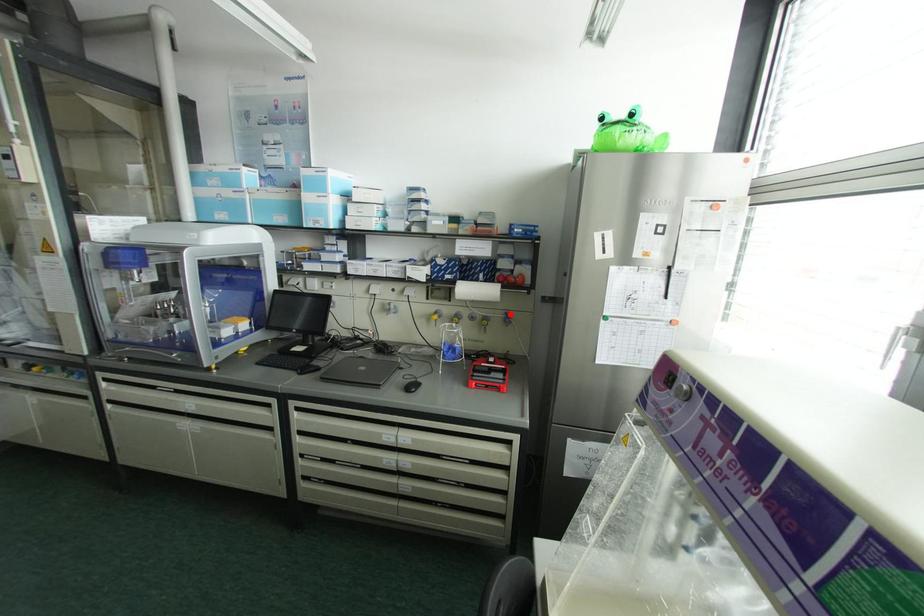
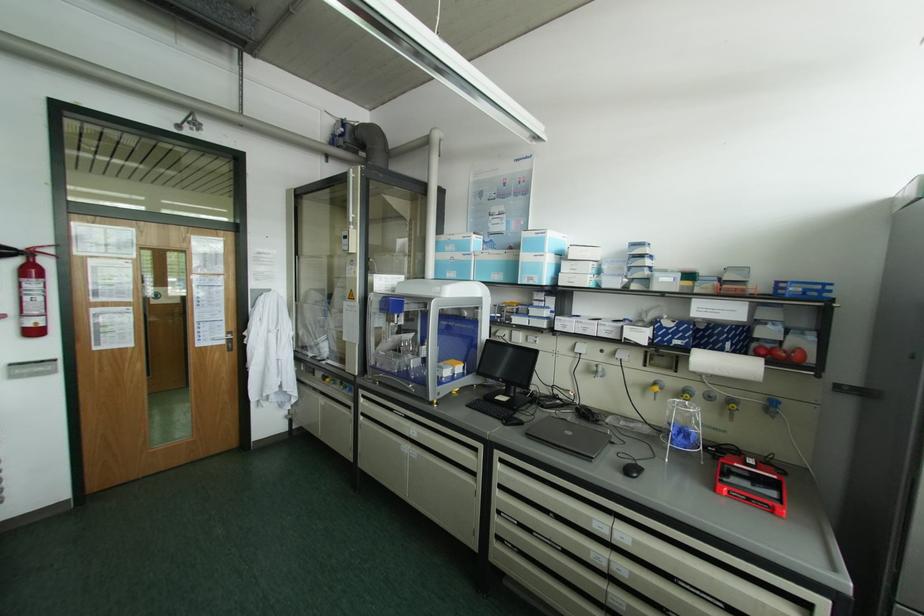
In the second image, find the point that corresponds to the highlighted location in the first image.

(777, 402)